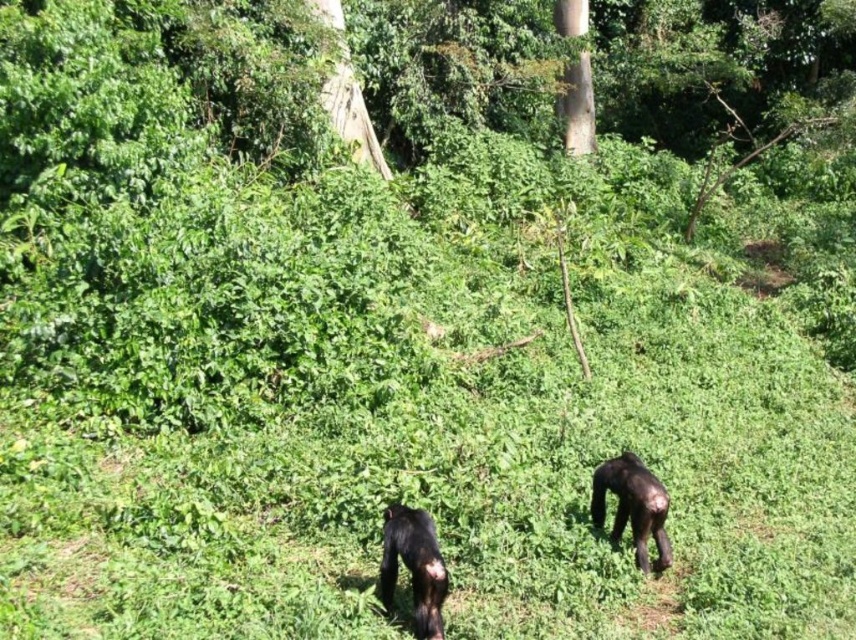
Question: Which object is positioned closest to the dark brown fur chimpanzee at lower right?

Choices:
 (A) brown rough tree at upper center
 (B) shiny dark brown chimpanzee at lower center

Answer: (B)

Question: Observing the image, what is the correct spatial positioning of dark brown fur chimpanzee at lower right in reference to brown rough tree at upper center?

Choices:
 (A) left
 (B) right

Answer: (A)

Question: Can you confirm if shiny dark brown chimpanzee at lower center is positioned to the left of brown rough tree at upper center?

Choices:
 (A) yes
 (B) no

Answer: (A)

Question: Which object is closer to the camera taking this photo?

Choices:
 (A) dark brown fur chimpanzee at lower right
 (B) shiny dark brown chimpanzee at lower center
 (C) brown rough tree at upper center

Answer: (B)

Question: Which object is positioned closest to the shiny dark brown chimpanzee at lower center?

Choices:
 (A) dark brown fur chimpanzee at lower right
 (B) brown rough tree at upper center

Answer: (A)

Question: Can you confirm if dark brown fur chimpanzee at lower right is bigger than brown rough tree at upper center?

Choices:
 (A) yes
 (B) no

Answer: (B)